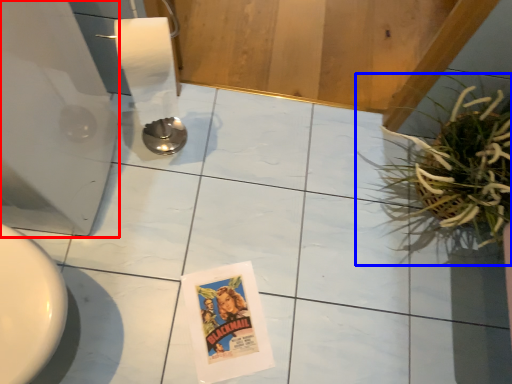
Question: Which point is closer to the camera, appliance (highlighted by a red box) or houseplant (highlighted by a blue box)?

Choices:
 (A) appliance
 (B) houseplant

Answer: (A)